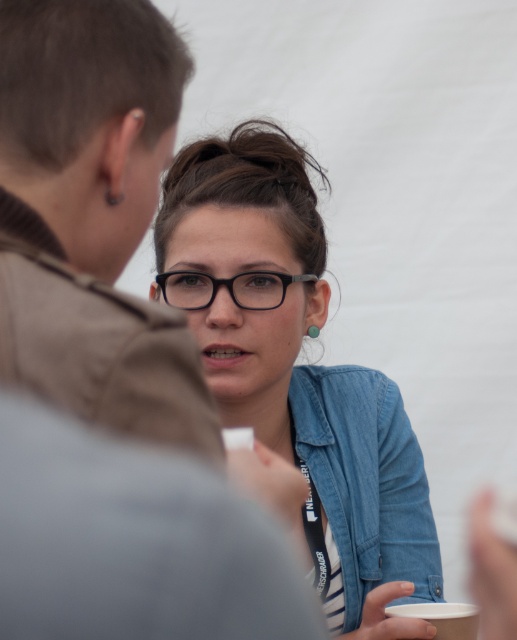
You are at a conference and need to identify which pair of glasses belongs to the person speaking. The person on the right is wearing both a matte black glasses at center and a black plastic glasses at center. Which glasses are positioned to the right side of the other?

The matte black glasses at center is positioned on the right side of black plastic glasses at center, so the matte black glasses at center are to the right of the black plastic glasses at center.

Based on the photo, you are a photographer standing in front of the scene. You want to take a photo of both the black plastic glasses at center and the white paper cup at lower right. Which object should you focus on first to ensure both are in focus?

You should focus on the black plastic glasses at center first because it is closer to you than the white paper cup at lower right, so adjusting focus from near to far will help both objects be in focus.

Based on the photo, please describe the location of the black plastic glasses in the image using the coordinate system provided. Specifically, what object is located at the coordinates point (x=227, y=289)?

A: The point (x=227, y=289) marks the location of the black plastic glasses at center.